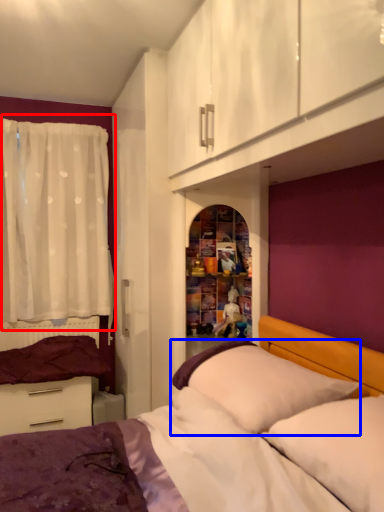
Question: Which point is closer to the camera, curtain (highlighted by a red box) or pillow (highlighted by a blue box)?

Choices:
 (A) curtain
 (B) pillow

Answer: (B)